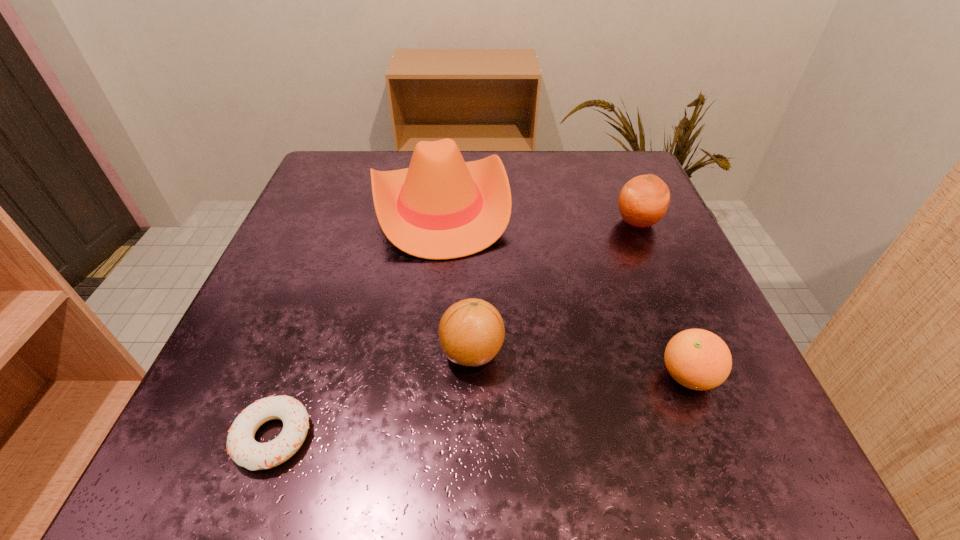
You are a GUI agent. You are given a task and a screenshot of the screen. Output one action in this format:
    pyautogui.click(x=<x>, y=<y>)
    Task: Click on the free space between the leftmost orange and the farthest orange
    
    Given the screenshot: What is the action you would take?
    pyautogui.click(x=555, y=287)

Identify the location of vacant area that lies between the fourth tallest object and the farthest orange. Image resolution: width=960 pixels, height=540 pixels. (662, 299).

In order to click on vacant region between the shortest orange and the nearest object in this screenshot , I will do `click(481, 407)`.

The width and height of the screenshot is (960, 540). Identify the location of free space between the leftmost orange and the cowboy hat. (456, 279).

Where is `empty space between the cowboy hat and the doughnut`? empty space between the cowboy hat and the doughnut is located at coordinates (357, 322).

Locate an element on the screen. This screenshot has width=960, height=540. object that is the fourth nearest to the fourth tallest object is located at coordinates pos(241,446).

Identify which object is located as the nearest to the doughnut. Please provide its 2D coordinates. Your answer should be formatted as a tuple, i.e. [(x, y)], where the tuple contains the x and y coordinates of a point satisfying the conditions above.

[(471, 332)]

Find the location of `orange that is the second closest to the shortest orange`. orange that is the second closest to the shortest orange is located at coordinates (643, 201).

Select which orange appears as the second closest to the leftmost orange. Please provide its 2D coordinates. Your answer should be formatted as a tuple, i.e. [(x, y)], where the tuple contains the x and y coordinates of a point satisfying the conditions above.

[(643, 201)]

I want to click on free spot that satisfies the following two spatial constraints: 1. on the front side of the cowboy hat; 2. on the left side of the leftmost orange, so click(424, 352).